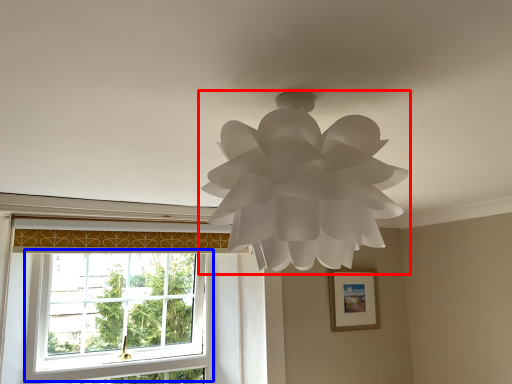
Question: Which object appears farthest to the camera in this image, lamp (highlighted by a red box) or window (highlighted by a blue box)?

Choices:
 (A) lamp
 (B) window

Answer: (B)